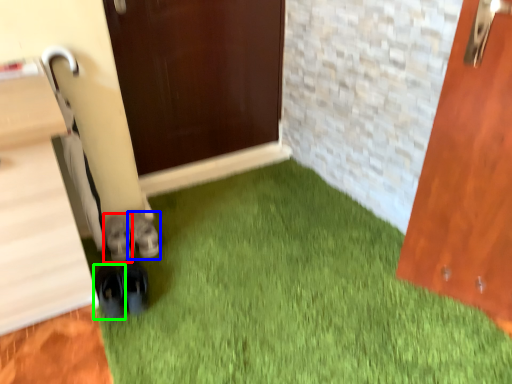
Question: Considering the real-world distances, which object is closest to footwear (highlighted by a red box)? footwear (highlighted by a blue box) or footwear (highlighted by a green box).

Choices:
 (A) footwear
 (B) footwear

Answer: (A)